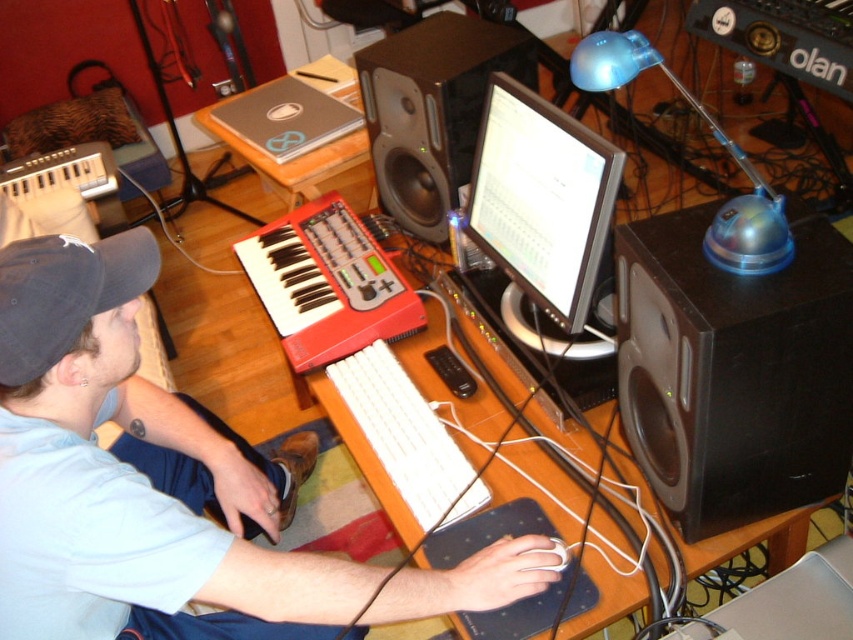
Is white matte keyboard at center wider than white plastic keyboard at center?

Yes.

Does white matte keyboard at center appear over white plastic keyboard at center?

No, white matte keyboard at center is not above white plastic keyboard at center.

Is point (160, 397) closer to camera compared to point (409, 396)?

No, (160, 397) is further to viewer.

Identify the location of white matte keyboard at center. (122, 467).

Can you confirm if white matte keyboard at center is bigger than black matte speaker at upper right?

Yes.

Which of these two, white matte keyboard at center or black matte speaker at upper right, stands taller?

Standing taller between the two is white matte keyboard at center.

Is point (112, 467) farther from viewer compared to point (770, 440)?

No.

You are a GUI agent. You are given a task and a screenshot of the screen. Output one action in this format:
    pyautogui.click(x=<x>, y=<y>)
    Task: Click on the white matte keyboard at center
    
    Given the screenshot: What is the action you would take?
    pyautogui.click(x=122, y=467)

Describe the element at coordinates (733, 371) in the screenshot. Image resolution: width=853 pixels, height=640 pixels. I see `black matte speaker at upper right` at that location.

Can you confirm if black matte speaker at upper right is thinner than white plastic keyboard at center?

No.

What do you see at coordinates (733, 371) in the screenshot? Image resolution: width=853 pixels, height=640 pixels. I see `black matte speaker at upper right` at bounding box center [733, 371].

The width and height of the screenshot is (853, 640). Identify the location of black matte speaker at upper right. (733, 371).